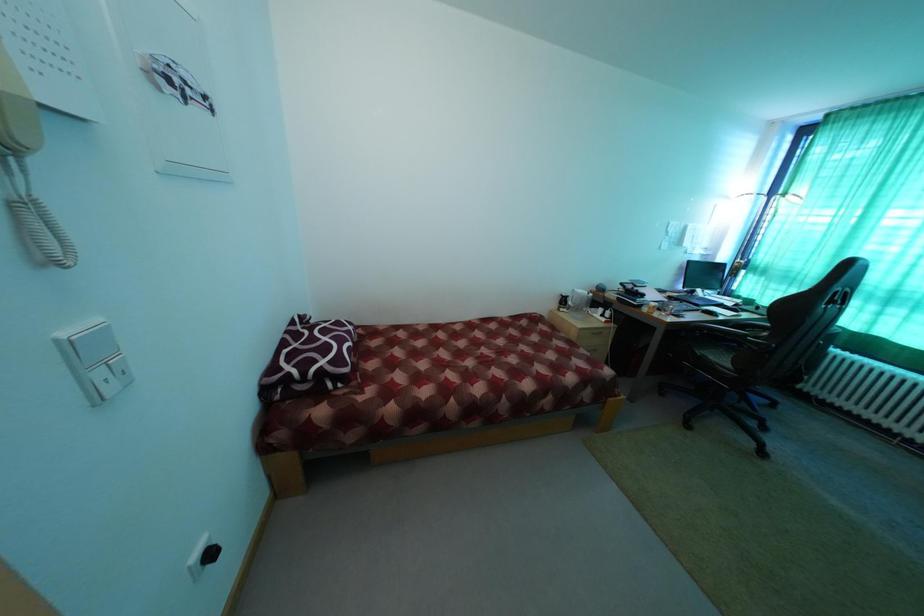
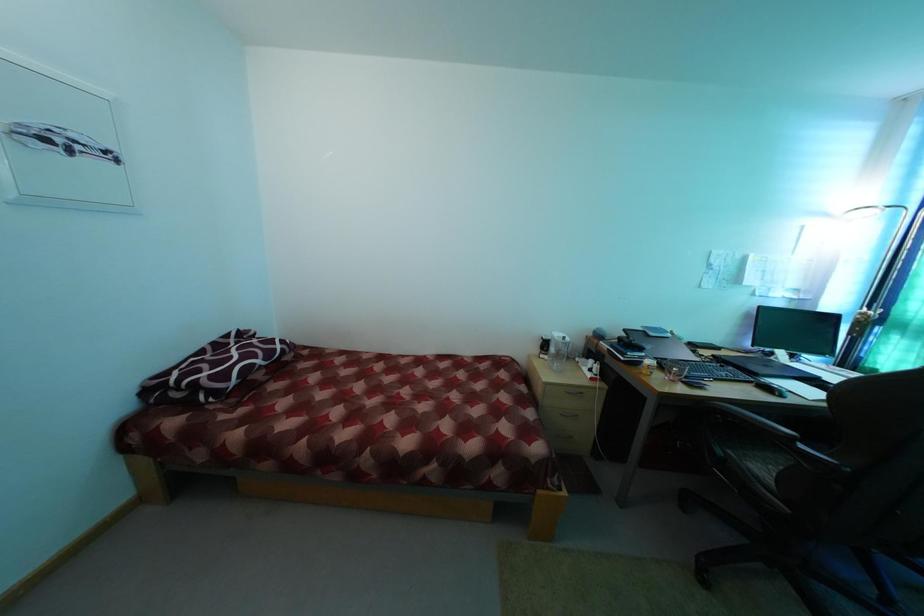
Question: The camera is either moving clockwise (left) or counter-clockwise (right) around the object. The first image is from the beginning of the video and the second image is from the end. Is the camera moving left or right when shooting the video?

Choices:
 (A) Left
 (B) Right

Answer: (B)